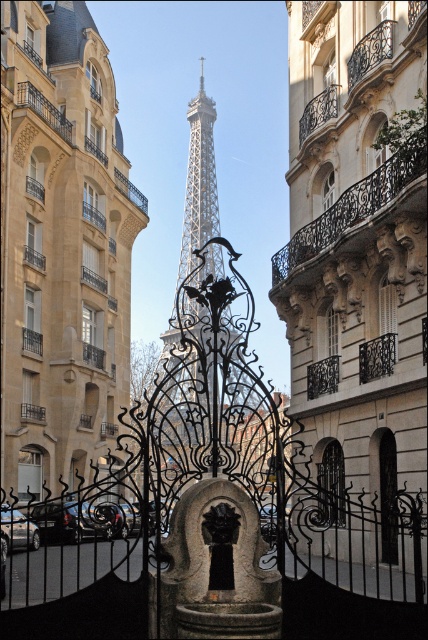
Can you confirm if smooth stone tower at center is positioned above black wrought iron gate at center?

Yes.

Is smooth stone tower at center to the left of black wrought iron gate at center from the viewer's perspective?

Yes, smooth stone tower at center is to the left of black wrought iron gate at center.

Between point (35, 342) and point (350, 612), which one is positioned behind?

Positioned behind is point (35, 342).

Locate an element on the screen. This screenshot has width=428, height=640. smooth stone tower at center is located at coordinates [62, 244].

Which is below, smooth stone tower at center or white metallic eiffel tower at center?

smooth stone tower at center is below.

Between point (59, 365) and point (199, 115), which one is positioned in front?

Positioned in front is point (59, 365).

Image resolution: width=428 pixels, height=640 pixels. What are the coordinates of `smooth stone tower at center` in the screenshot? It's located at (62, 244).

Is point (321, 579) less distant than point (193, 124)?

Yes, it is in front of point (193, 124).

Which is behind, point (100, 625) or point (196, 216)?

Point (196, 216)

You are a GUI agent. You are given a task and a screenshot of the screen. Output one action in this format:
    pyautogui.click(x=<x>, y=<y>)
    Task: Click on the black wrought iron gate at center
    This screenshot has width=428, height=640.
    Given the screenshot: What is the action you would take?
    pyautogui.click(x=345, y=612)